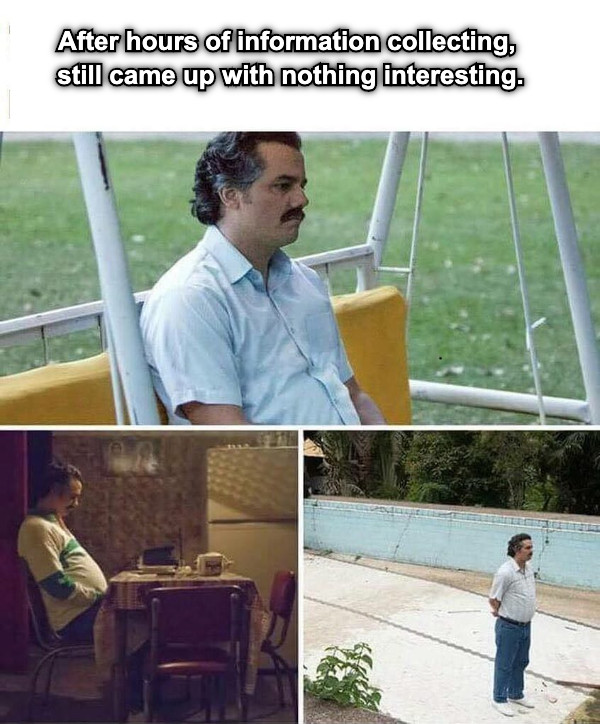
At what (x,y) coordinates should I click in order to perform the action: click on refrigerator. Please return your answer as a coordinate pair (x, y). The height and width of the screenshot is (724, 600). Looking at the image, I should click on (265, 560).